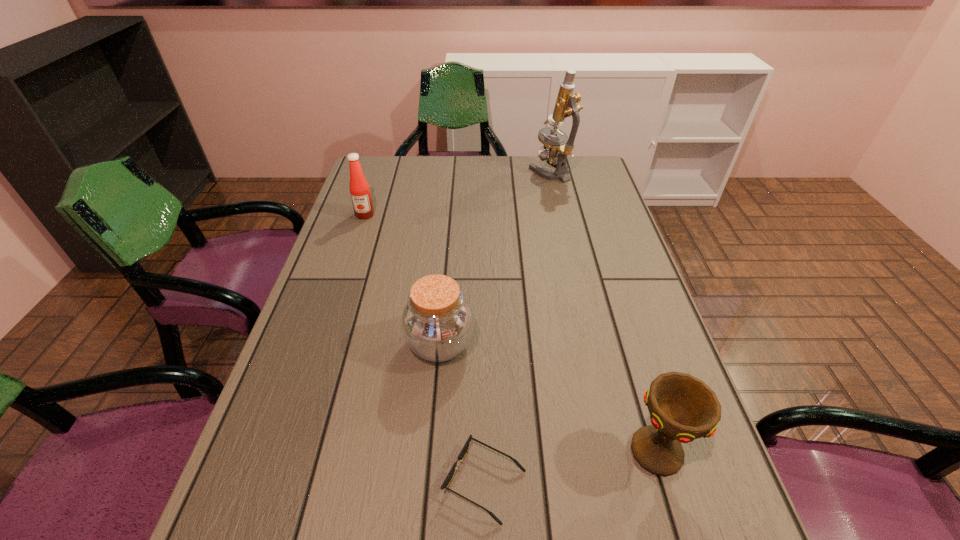
Identify the location of microscope. This screenshot has height=540, width=960. (555, 150).

Where is `the tallest object`? the tallest object is located at coordinates (555, 150).

Where is `the leftmost object`? The height and width of the screenshot is (540, 960). the leftmost object is located at coordinates (362, 202).

The image size is (960, 540). I want to click on condiment, so pos(362,202).

The image size is (960, 540). I want to click on chalice, so click(682, 408).

Locate an element on the screen. jar is located at coordinates (437, 322).

Where is `sunglasses`? sunglasses is located at coordinates (464, 450).

At what (x,y) coordinates should I click in order to perform the action: click on free region located on the right of the microscope. Please return your answer as a coordinate pair (x, y). The image size is (960, 540). Looking at the image, I should click on (586, 172).

Image resolution: width=960 pixels, height=540 pixels. In order to click on free space located on the front-facing side of the fourth nearest object in this screenshot , I will do `click(348, 266)`.

Find the location of a particular element. This screenshot has height=540, width=960. vacant region located 0.150m on the back of the chalice is located at coordinates (630, 360).